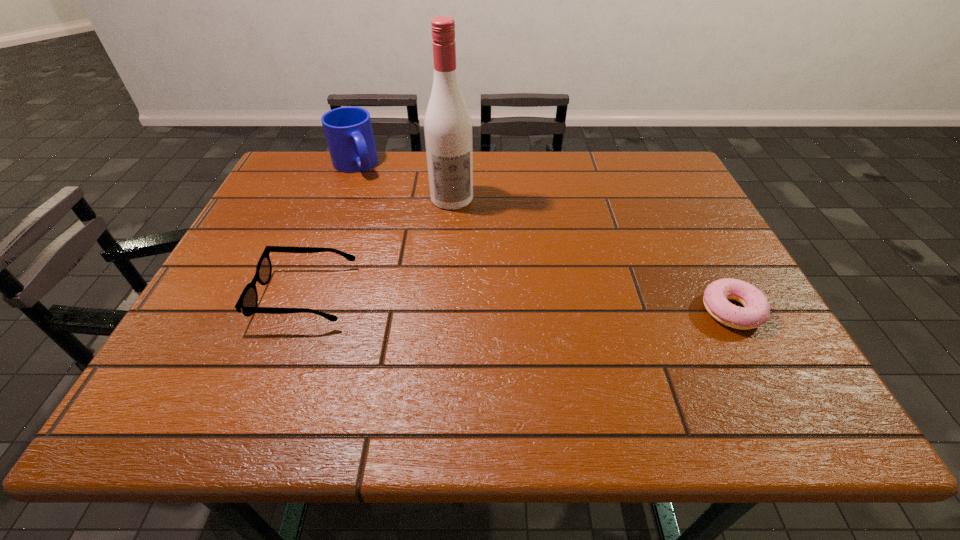
I want to click on mug present at the left edge, so click(348, 130).

Locate an element on the screen. Image resolution: width=960 pixels, height=540 pixels. object positioned at the right edge is located at coordinates (756, 310).

I want to click on object at the far left corner, so click(x=348, y=130).

The height and width of the screenshot is (540, 960). In the image, there is a desktop. Identify the location of blank space at the far edge. (596, 157).

Locate an element on the screen. Image resolution: width=960 pixels, height=540 pixels. vacant space at the near edge of the desktop is located at coordinates (364, 363).

The height and width of the screenshot is (540, 960). Find the location of `vacant space at the left edge`. vacant space at the left edge is located at coordinates (285, 266).

In the image, there is a desktop. Identify the location of vacant area at the right edge. (659, 242).

In the image, there is a desktop. Where is `vacant space at the far left corner`? The image size is (960, 540). vacant space at the far left corner is located at coordinates (300, 195).

In the image, there is a desktop. Where is `vacant space at the near left corner`? vacant space at the near left corner is located at coordinates (191, 355).

In the image, there is a desktop. Where is `vacant space at the far right corner`? vacant space at the far right corner is located at coordinates (632, 161).